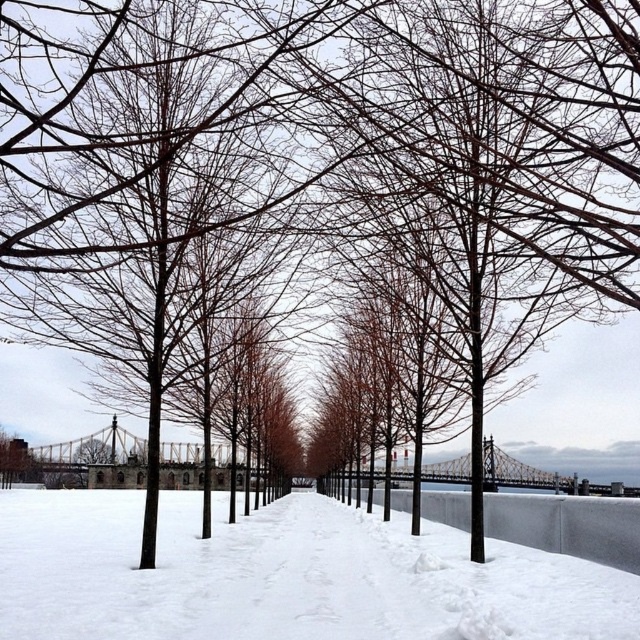
You are standing at the center of the path in the winter scene. You want to walk towards the brown matte tree at center and the white snow at center. Which one will you reach first?

The white snow at center is closer to you than the brown matte tree at center, so you will reach the white snow at center first.

You are an artist planning to paint this winter scene. You want to ensure the brown matte tree at center and the white snow at center are proportionally accurate. Which object should you paint to be wider?

The white snow at center should be painted wider since the brown matte tree at center has a lesser width compared to it.